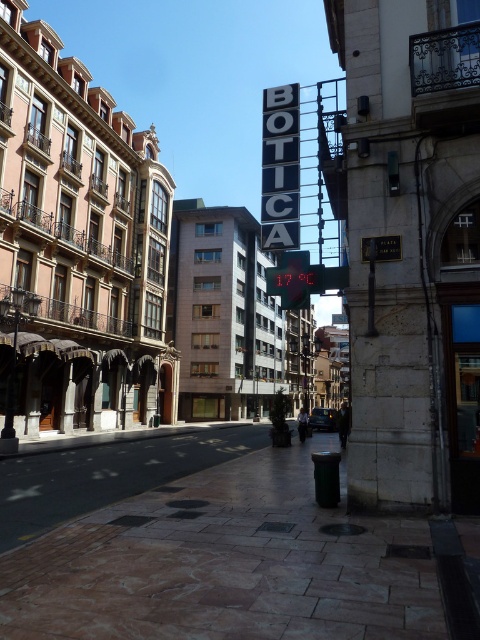
You are a delivery person with a cart that is 10 feet long. You need to move your cart from the brown stone pavement at lower center to the black metal sign at upper center. Is there enough space to move the cart straight without tilting it sideways?

The distance between the brown stone pavement at lower center and the black metal sign at upper center is 22.29 feet, which is more than the cart length of 10 feet. Therefore, there is sufficient space to move the cart straight without tilting it sideways.

You are a delivery person who needs to place a package on the ground. The package is 1.2 meters tall. You see the brown stone pavement at lower center and the black metal sign at upper center. Which object can you safely place the package on without it exceeding the height limit?

The brown stone pavement at lower center is shorter than the black metal sign at upper center. Since the package is 1.2 meters tall, it can be safely placed on the brown stone pavement at lower center as it is shorter and can accommodate the package height.